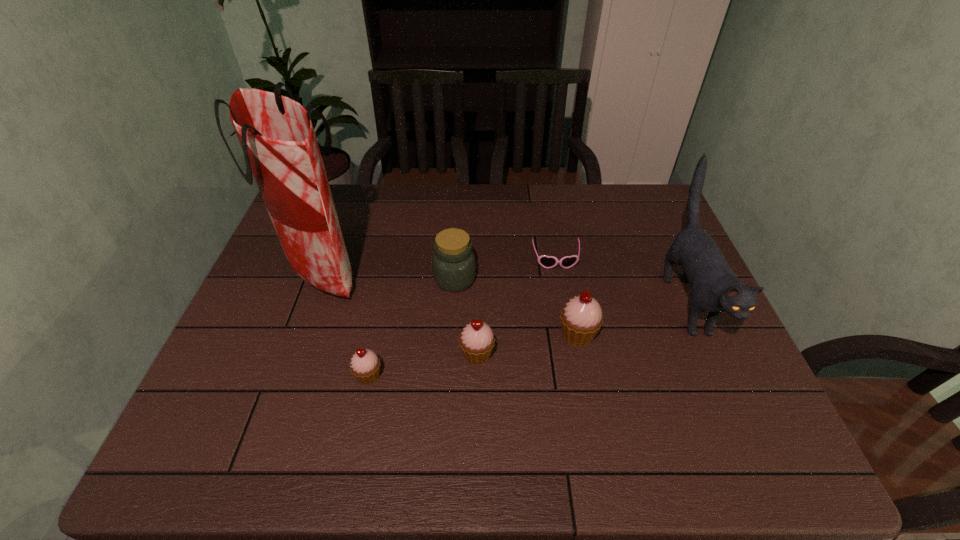
At what (x,y) coordinates should I click in order to perform the action: click on vacant place for an extra cupcake on the right. Please return your answer as a coordinate pair (x, y). The height and width of the screenshot is (540, 960). Looking at the image, I should click on (670, 316).